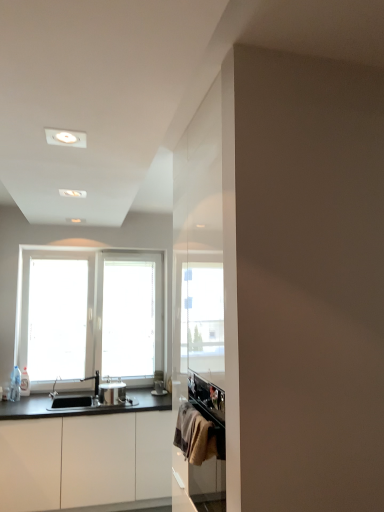
Question: Is clear glass bottle at left positioned with its back to satin nickel faucet at sink left?

Choices:
 (A) yes
 (B) no

Answer: (B)

Question: Is clear glass bottle at left far away from satin nickel faucet at sink left?

Choices:
 (A) yes
 (B) no

Answer: (B)

Question: Is clear glass bottle at left thinner than satin nickel faucet at sink left?

Choices:
 (A) yes
 (B) no

Answer: (A)

Question: Is clear glass bottle at left shorter than satin nickel faucet at sink left?

Choices:
 (A) yes
 (B) no

Answer: (B)

Question: From a real-world perspective, is clear glass bottle at left beneath satin nickel faucet at sink left?

Choices:
 (A) yes
 (B) no

Answer: (B)

Question: Is point (97, 373) closer or farther from the camera than point (155, 381)?

Choices:
 (A) farther
 (B) closer

Answer: (B)

Question: Relative to metallic silver toaster at center, positioned as the 2th appliance in front-to-back order, is satin nickel faucet at sink left in front or behind?

Choices:
 (A) front
 (B) behind

Answer: (A)

Question: From the image's perspective, is satin nickel faucet at sink left positioned above or below metallic silver toaster at center, the second appliance positioned from the left?

Choices:
 (A) below
 (B) above

Answer: (B)

Question: Is satin nickel faucet at sink left to the left or to the right of metallic silver toaster at center, the first appliance from the back, in the image?

Choices:
 (A) left
 (B) right

Answer: (A)

Question: From the image's perspective, is satin nickel faucet at sink left above or below satin silver pot at center, positioned as the second appliance in right-to-left order?

Choices:
 (A) above
 (B) below

Answer: (A)

Question: Is satin nickel faucet at sink left wider or thinner than satin silver pot at center, positioned as the second appliance in right-to-left order?

Choices:
 (A) wide
 (B) thin

Answer: (B)

Question: From a real-world perspective, relative to satin silver pot at center, which ranks as the 2th appliance in back-to-front order, is satin nickel faucet at sink left vertically above or below?

Choices:
 (A) below
 (B) above

Answer: (B)

Question: Is satin nickel faucet at sink left bigger or smaller than satin silver pot at center, which ranks as the 2th appliance in back-to-front order?

Choices:
 (A) small
 (B) big

Answer: (A)

Question: From a real-world perspective, is satin silver pot at center, positioned as the second appliance in right-to-left order, physically located above or below textured beige towel at lower right?

Choices:
 (A) above
 (B) below

Answer: (B)

Question: Is point (117, 398) positioned closer to the camera than point (193, 412)?

Choices:
 (A) farther
 (B) closer

Answer: (A)